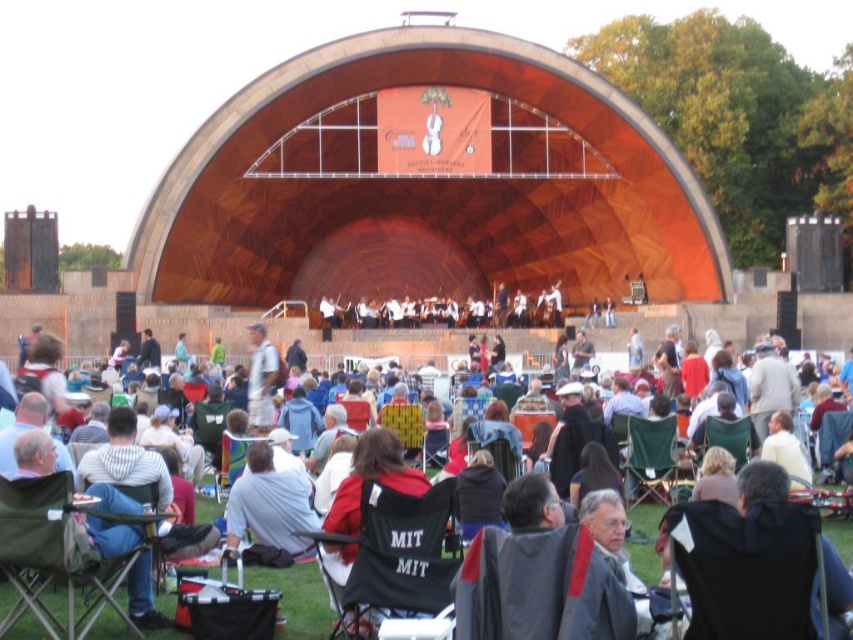
Can you confirm if wooden amphitheater at center is wider than black fabric chair at center?

Indeed, wooden amphitheater at center has a greater width compared to black fabric chair at center.

Is point (637, 124) closer to viewer compared to point (751, 620)?

No, it is behind (751, 620).

At what (x,y) coordinates should I click in order to perform the action: click on wooden amphitheater at center. Please return your answer as a coordinate pair (x, y). Looking at the image, I should click on (426, 186).

Which is more to the left, green fabric chair at lower left or light gray fabric jacket at center?

From the viewer's perspective, green fabric chair at lower left appears more on the left side.

This screenshot has height=640, width=853. In order to click on green fabric chair at lower left in this screenshot , I will do `click(55, 556)`.

Does point (28, 605) come closer to viewer compared to point (270, 371)?

Yes, it is in front of point (270, 371).

This screenshot has height=640, width=853. I want to click on green fabric chair at lower left, so click(x=55, y=556).

Does black fabric chairs at center appear on the left side of green fabric chair at lower center?

Yes, black fabric chairs at center is to the left of green fabric chair at lower center.

Is point (850, 534) positioned in front of point (631, 499)?

Yes, it is in front of point (631, 499).

Is point (88, 337) less distant than point (624, 483)?

No, it is not.

Image resolution: width=853 pixels, height=640 pixels. Identify the location of black fabric chairs at center. (299, 600).